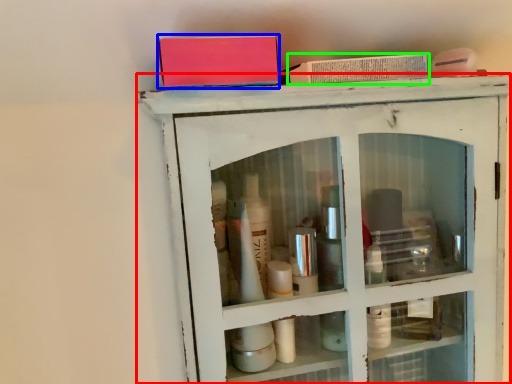
Question: Which object is the closest to the shelf (highlighted by a red box)? Choose among these: book (highlighted by a blue box) or book (highlighted by a green box).

Choices:
 (A) book
 (B) book

Answer: (B)